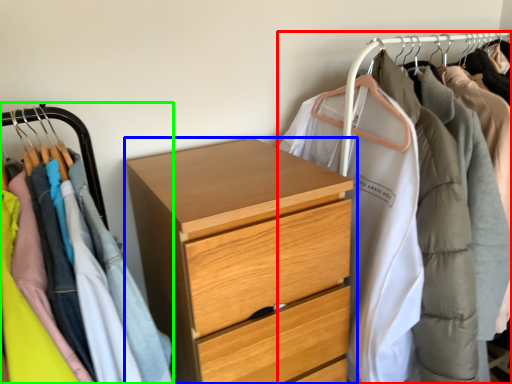
Question: Which object is the farthest from closet (highlighted by a red box)? Choose among these: chest of drawers (highlighted by a blue box) or closet (highlighted by a green box).

Choices:
 (A) chest of drawers
 (B) closet

Answer: (B)